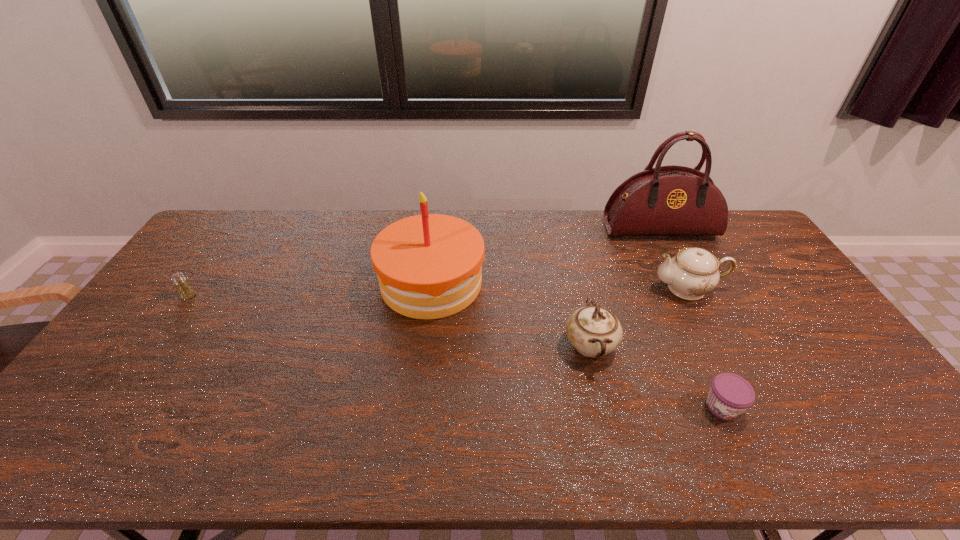
What are the coordinates of `blank area located 0.340m at the spout of the farther chinaware` in the screenshot? It's located at (545, 288).

The height and width of the screenshot is (540, 960). What are the coordinates of `free space located 0.240m at the spout of the farther chinaware` in the screenshot? It's located at (576, 288).

At what (x,y) coordinates should I click in order to perform the action: click on vacant space situated 0.080m on the right of the left chinaware. Please return your answer as a coordinate pair (x, y). This screenshot has width=960, height=540. Looking at the image, I should click on [x=645, y=346].

Where is `vacant position located 0.200m on the front of the leftmost object`? Image resolution: width=960 pixels, height=540 pixels. vacant position located 0.200m on the front of the leftmost object is located at coordinates (150, 352).

I want to click on object present at the far edge, so click(x=672, y=200).

At what (x,y) coordinates should I click in order to perform the action: click on object situated at the left edge. Please return your answer as a coordinate pair (x, y). This screenshot has height=540, width=960. Looking at the image, I should click on (185, 290).

Identify the location of object at the right edge. (672, 200).

Find the location of a particular element. Image resolution: width=960 pixels, height=540 pixels. object at the far right corner is located at coordinates (672, 200).

In the image, there is a desktop. At what (x,y) coordinates should I click in order to perform the action: click on vacant space at the far edge. Please return your answer as a coordinate pair (x, y). Image resolution: width=960 pixels, height=540 pixels. Looking at the image, I should click on (512, 248).

The image size is (960, 540). What are the coordinates of `vacant space at the near edge of the desktop` in the screenshot? It's located at (656, 453).